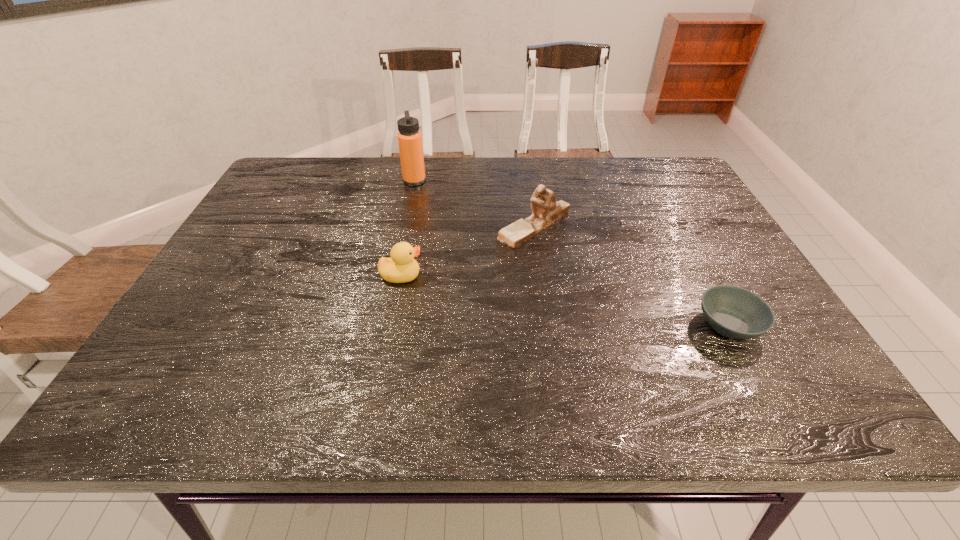
Where is `thermos bottle`? The image size is (960, 540). thermos bottle is located at coordinates (409, 137).

What are the coordinates of `the tallest object` in the screenshot? It's located at coord(409,137).

This screenshot has height=540, width=960. I want to click on figurine, so click(x=546, y=209).

Identify the location of the second farthest object. [x=546, y=209].

In order to click on the third farthest object in this screenshot , I will do `click(402, 267)`.

The image size is (960, 540). What are the coordinates of `duck` in the screenshot? It's located at (402, 267).

Where is `soup bowl`? soup bowl is located at coordinates (734, 312).

At what (x,y) coordinates should I click in order to perform the action: click on the rightmost object. Please return your answer as a coordinate pair (x, y). The width and height of the screenshot is (960, 540). Looking at the image, I should click on (734, 312).

The height and width of the screenshot is (540, 960). What are the coordinates of `free space located 0.180m on the right of the tallest object` in the screenshot? It's located at (485, 181).

This screenshot has width=960, height=540. Identify the location of vacant space located on the front-facing side of the second farthest object. [421, 226].